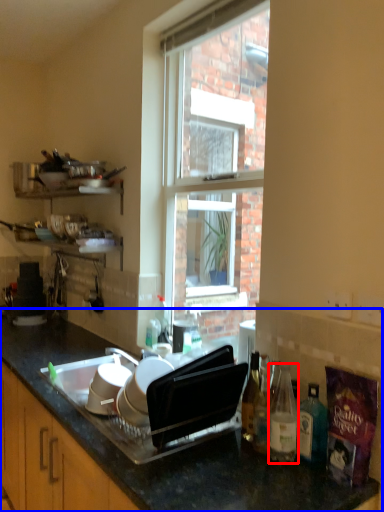
Question: Which object is closer to the camera taking this photo, bottle (highlighted by a red box) or countertop (highlighted by a blue box)?

Choices:
 (A) bottle
 (B) countertop

Answer: (B)